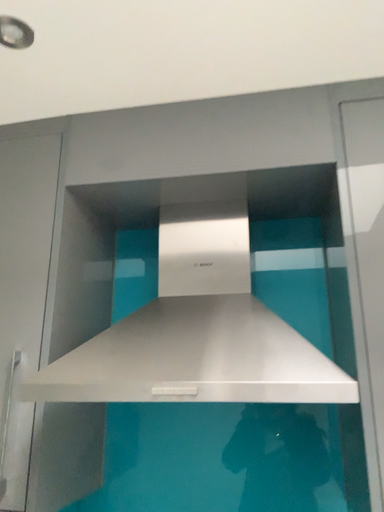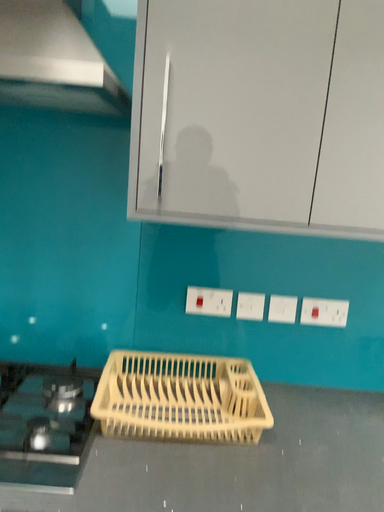
Question: Which way did the camera rotate in the video?

Choices:
 (A) rotated downward
 (B) rotated upward

Answer: (A)